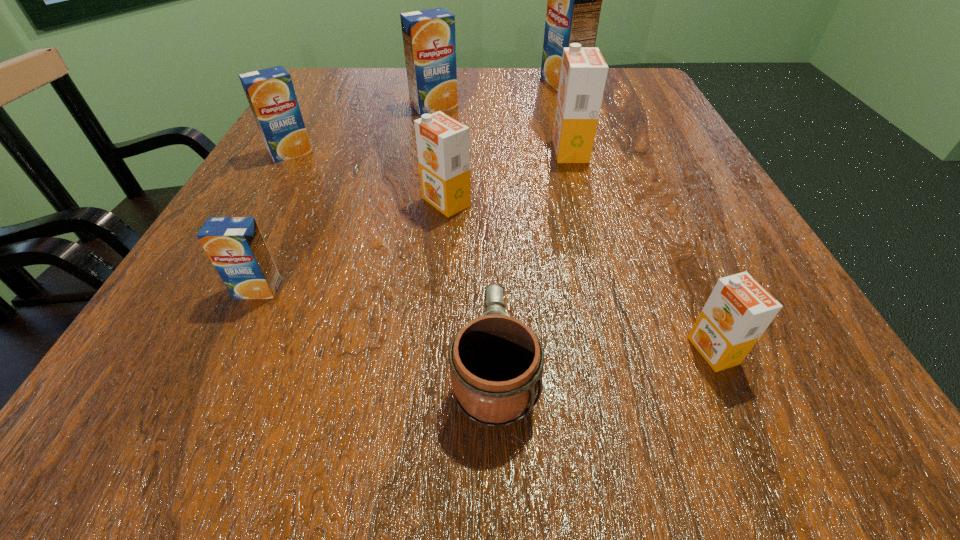
Find the location of a particular element. The width and height of the screenshot is (960, 540). free area in between the mug and the third farthest blue orange_juice is located at coordinates (393, 263).

At what (x,y) coordinates should I click in order to perform the action: click on object that stands as the seventh closest to the tallest orange juice. Please return your answer as a coordinate pair (x, y). The image size is (960, 540). Looking at the image, I should click on (235, 245).

Identify which object is the fourth closest to the nearest orange juice. Please provide its 2D coordinates. Your answer should be formatted as a tuple, i.e. [(x, y)], where the tuple contains the x and y coordinates of a point satisfying the conditions above.

[(235, 245)]

I want to click on orange juice object that ranks as the closest to the farthest object, so click(429, 39).

Locate which orange juice is the sixth closest to the nearest blue orange_juice. Please provide its 2D coordinates. Your answer should be formatted as a tuple, i.e. [(x, y)], where the tuple contains the x and y coordinates of a point satisfying the conditions above.

[(574, 0)]

Locate an element on the screen. The width and height of the screenshot is (960, 540). blue orange_juice that is the closest one to the third blue orange_juice from left to right is located at coordinates (270, 92).

Identify the location of the third closest blue orange_juice to the second blue orange_juice from right to left. Image resolution: width=960 pixels, height=540 pixels. (235, 245).

Where is `orange orange juice that stands as the second closest to the mug`? The width and height of the screenshot is (960, 540). orange orange juice that stands as the second closest to the mug is located at coordinates click(443, 144).

I want to click on orange orange juice that stands as the closest to the second biggest orange orange juice, so click(583, 74).

This screenshot has width=960, height=540. I want to click on free point that satisfies the following two spatial constraints: 1. on the front side of the second nearest blue orange_juice; 2. on the right side of the nearest orange orange juice, so click(178, 350).